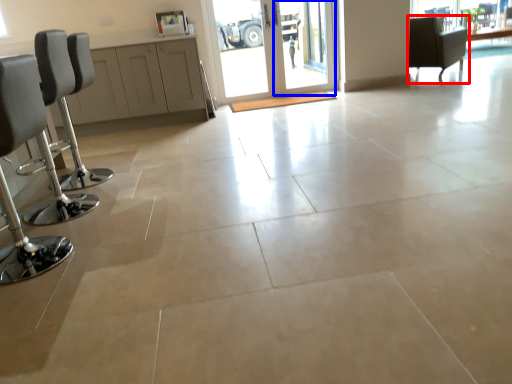
Question: Which object appears closest to the camera in this image, chair (highlighted by a red box) or screen door (highlighted by a blue box)?

Choices:
 (A) chair
 (B) screen door

Answer: (B)